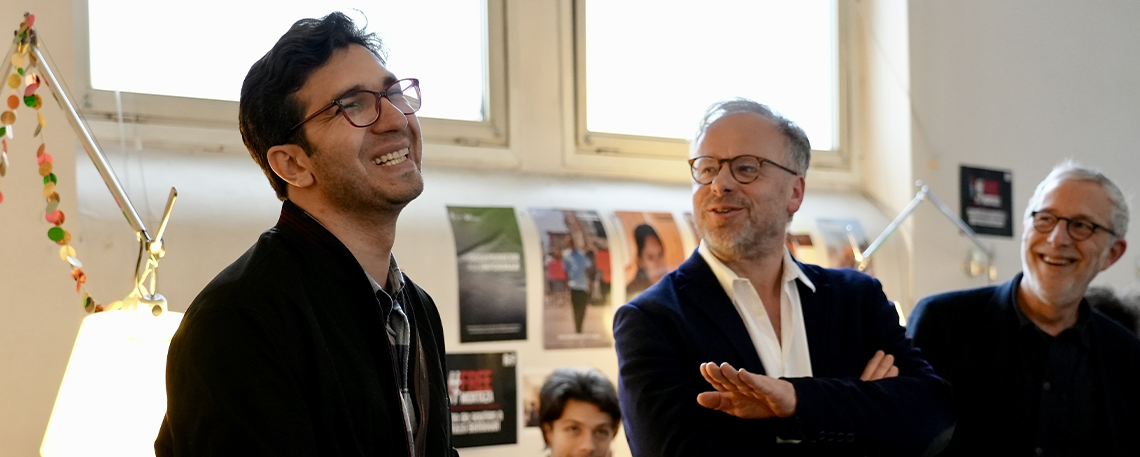
I want to click on wall, so click(x=1018, y=91).